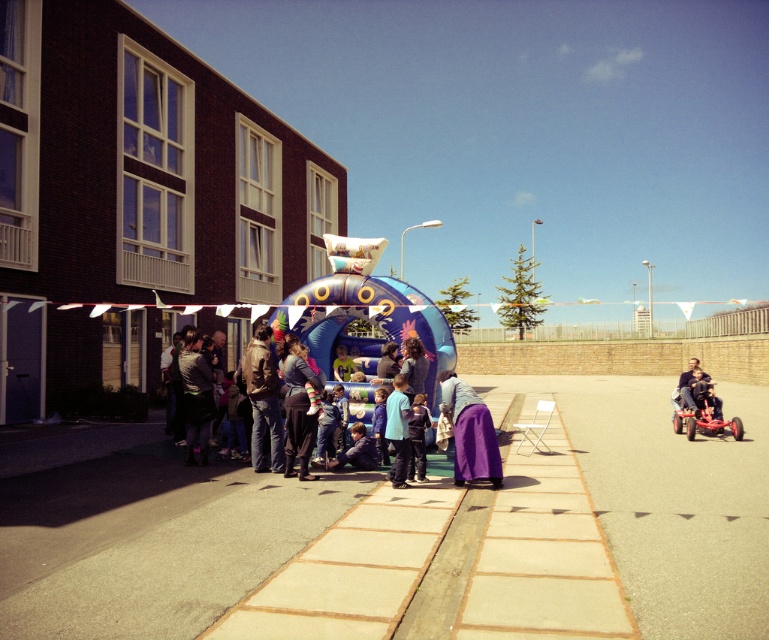
You are standing at the center of the courtyard and want to find the purple fabric at lower center. According to the coordinates provided, in which direction should you move to locate it?

The purple fabric at lower center is located at coordinates point (x=470, y=432). Since the center of the courtyard is at point (x=384, y=320), you should move towards the right and slightly downward to reach it.

Based on the photo, you are standing at point (398, 378) and want to walk towards the inflatable structure in the center. Is point (463, 460) located in front of you or behind you?

Point (463, 460) is in front of point (398, 378), so it is located in front of you as you face the inflatable structure in the center.